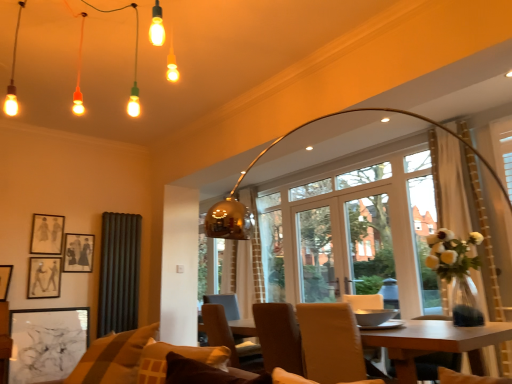
Question: Is brown leather chair at center, the first chair in the back-to-front sequence, not near matte black picture frame at upper left, the 4th picture frame ordered from the bottom?

Choices:
 (A) no
 (B) yes

Answer: (B)

Question: Considering the relative sizes of brown leather chair at center, positioned as the second chair in right-to-left order, and matte black picture frame at upper left, the 4th picture frame ordered from the bottom, in the image provided, is brown leather chair at center, positioned as the second chair in right-to-left order, wider than matte black picture frame at upper left, the 4th picture frame ordered from the bottom,?

Choices:
 (A) yes
 (B) no

Answer: (A)

Question: Is brown leather chair at center, which is counted as the first chair, starting from the left, oriented away from matte black picture frame at upper left, the 4th picture frame ordered from the bottom?

Choices:
 (A) yes
 (B) no

Answer: (B)

Question: Can you confirm if brown leather chair at center, the first chair in the back-to-front sequence, is positioned to the right of matte black picture frame at upper left, the 4th picture frame ordered from the bottom?

Choices:
 (A) no
 (B) yes

Answer: (B)

Question: Could you tell me if brown leather chair at center, the first chair in the back-to-front sequence, is turned towards matte black picture frame at upper left, the 1th picture frame viewed from the top?

Choices:
 (A) yes
 (B) no

Answer: (B)

Question: In terms of size, does wooden table at center appear bigger or smaller than matte black picture frame at upper left, the 4th picture frame ordered from the bottom?

Choices:
 (A) big
 (B) small

Answer: (A)

Question: Is wooden table at center in front of or behind matte black picture frame at upper left, the 1th picture frame viewed from the top, in the image?

Choices:
 (A) front
 (B) behind

Answer: (A)

Question: Based on their positions, is wooden table at center located to the left or right of matte black picture frame at upper left, the 4th picture frame ordered from the bottom?

Choices:
 (A) left
 (B) right

Answer: (B)

Question: From a real-world perspective, is wooden table at center positioned above or below matte black picture frame at upper left, the 4th picture frame ordered from the bottom?

Choices:
 (A) above
 (B) below

Answer: (B)

Question: Considering the positions of gold metallic curtain at center, the first curtain viewed from the back, and black matte picture frame at lower left, the first picture frame in the bottom-to-top sequence, in the image, is gold metallic curtain at center, the first curtain viewed from the back, bigger or smaller than black matte picture frame at lower left, the first picture frame in the bottom-to-top sequence,?

Choices:
 (A) big
 (B) small

Answer: (A)

Question: In the image, is gold metallic curtain at center, the first curtain viewed from the back, on the left side or the right side of black matte picture frame at lower left, the first picture frame in the bottom-to-top sequence?

Choices:
 (A) left
 (B) right

Answer: (B)

Question: From a real-world perspective, is gold metallic curtain at center, the 2th curtain viewed from the front, above or below black matte picture frame at lower left, the first picture frame in the bottom-to-top sequence?

Choices:
 (A) below
 (B) above

Answer: (B)

Question: Is gold metallic curtain at center, placed as the 1th curtain when sorted from right to left, spatially inside black matte picture frame at lower left, acting as the 4th picture frame starting from the top, or outside of it?

Choices:
 (A) inside
 (B) outside

Answer: (B)

Question: Looking at the image, does brown leather chair at center, which is counted as the first chair, starting from the left, seem bigger or smaller compared to matte black picture frame at upper left, the 1th picture frame viewed from the top?

Choices:
 (A) big
 (B) small

Answer: (A)

Question: From a real-world perspective, is brown leather chair at center, the first chair in the back-to-front sequence, above or below matte black picture frame at upper left, the 4th picture frame ordered from the bottom?

Choices:
 (A) above
 (B) below

Answer: (B)